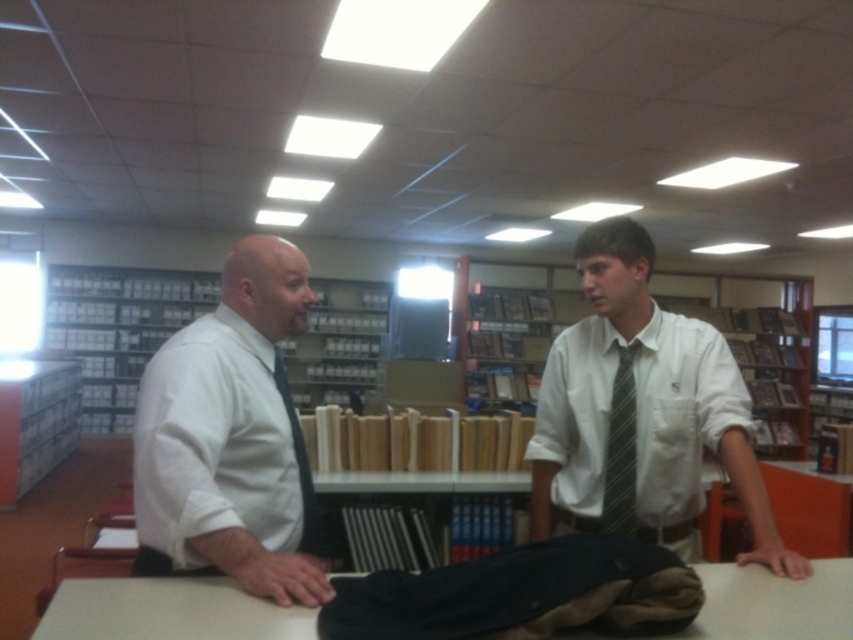
Does white shirt at left have a larger size compared to white cardboard bookshelf at upper center?

Incorrect, white shirt at left is not larger than white cardboard bookshelf at upper center.

Does white shirt at left come in front of white cardboard bookshelf at upper center?

Yes, white shirt at left is in front of white cardboard bookshelf at upper center.

Between point (294, 305) and point (114, 404), which one is positioned in front?

Point (294, 305) is in front.

The height and width of the screenshot is (640, 853). What are the coordinates of `white shirt at left` in the screenshot? It's located at (230, 438).

Does point (756, 612) come in front of point (633, 488)?

Yes, it is.

Describe the element at coordinates (167, 611) in the screenshot. This screenshot has width=853, height=640. I see `white smooth table at center` at that location.

In the scene shown: Measure the distance between point (x=84, y=621) and camera.

Point (x=84, y=621) is 1.18 meters away from camera.

You are a GUI agent. You are given a task and a screenshot of the screen. Output one action in this format:
    pyautogui.click(x=<x>, y=<y>)
    Task: Click on the white smooth table at center
    Image resolution: width=853 pixels, height=640 pixels.
    Given the screenshot: What is the action you would take?
    pyautogui.click(x=167, y=611)

Between point (257, 504) and point (70, 438), which one is positioned behind?

Point (70, 438)

Is white shirt at left bigger than white cardboard bookshelf at left?

Actually, white shirt at left might be smaller than white cardboard bookshelf at left.

Locate an element on the screen. white shirt at left is located at coordinates (230, 438).

Where is `white shirt at left`? The width and height of the screenshot is (853, 640). white shirt at left is located at coordinates (230, 438).